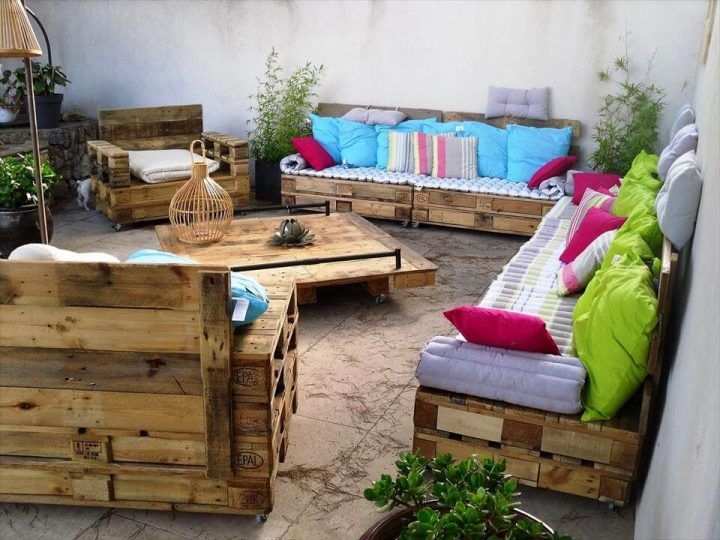
Where is `green cushions`? green cushions is located at coordinates (607, 310), (618, 249), (638, 224), (638, 195), (643, 176), (649, 158).